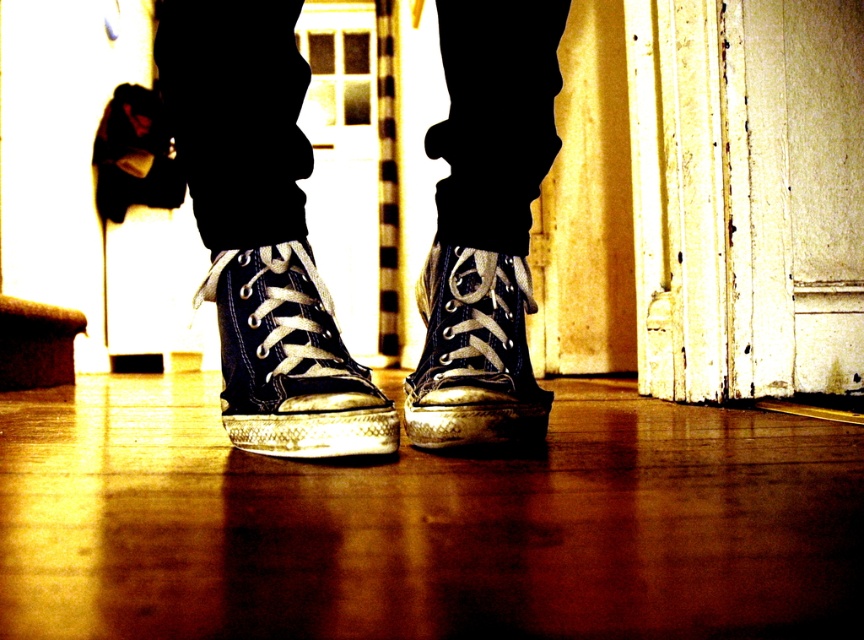
Question: Which object is the farthest from the matte black sneaker at center?

Choices:
 (A) checkerboard fabric door at center
 (B) matte canvas sneaker at center
 (C) matte canvas sneakers at center

Answer: (A)

Question: Is matte canvas sneakers at center above checkerboard fabric door at center?

Choices:
 (A) yes
 (B) no

Answer: (B)

Question: Considering the relative positions of checkerboard fabric door at center and matte black sneaker at center in the image provided, where is checkerboard fabric door at center located with respect to matte black sneaker at center?

Choices:
 (A) right
 (B) left

Answer: (B)

Question: Can you confirm if checkerboard fabric door at center is positioned to the left of matte black sneaker at center?

Choices:
 (A) no
 (B) yes

Answer: (B)

Question: Which object is closer to the camera taking this photo?

Choices:
 (A) matte black sneaker at center
 (B) matte canvas sneaker at center
 (C) checkerboard fabric door at center

Answer: (A)

Question: Which object is closer to the camera taking this photo?

Choices:
 (A) matte canvas sneaker at center
 (B) matte black sneaker at center
 (C) checkerboard fabric door at center
 (D) matte canvas sneakers at center

Answer: (B)